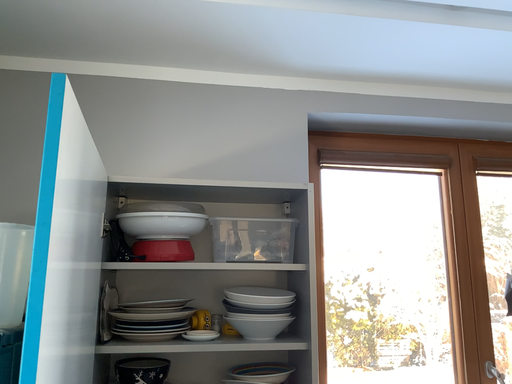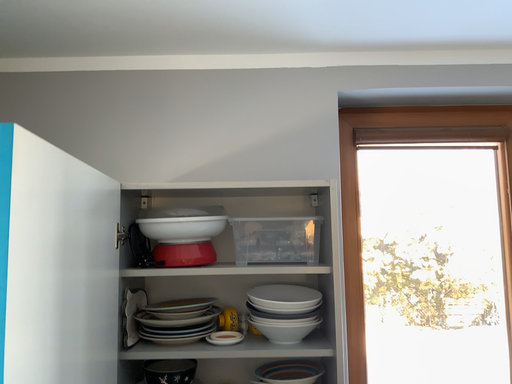
Question: Which way did the camera rotate in the video?

Choices:
 (A) rotated left
 (B) rotated right

Answer: (A)